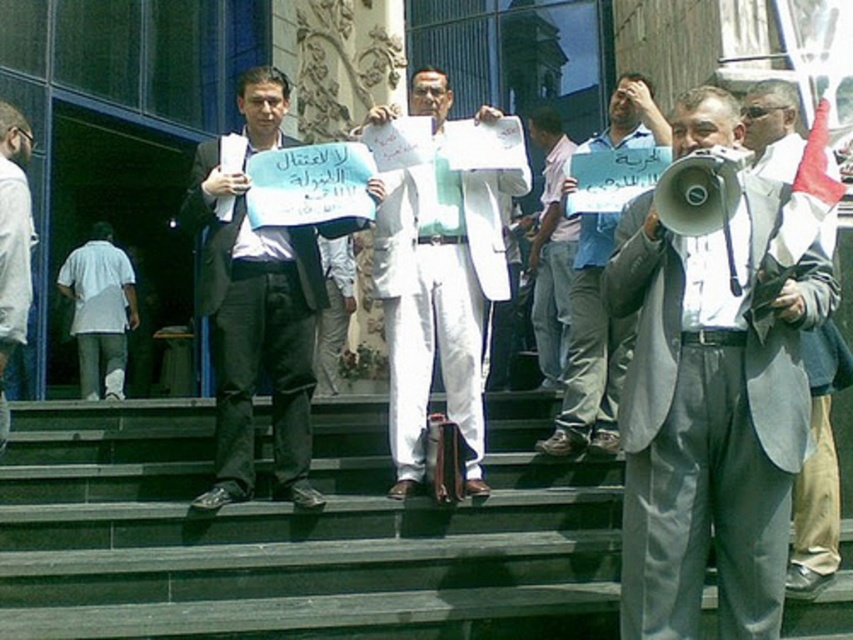
You are a photographer trying to capture a clear photo of the light gray suit coat at center and the white shirt at left. Since you want both subjects to appear the same size in the photo, which subject should you move closer to the camera?

The light gray suit coat at center has a larger width than the white shirt at left, so you should move the light gray suit coat at center closer to the camera to make them appear the same size in the photo.

You are a photographer trying to capture a clear shot of the gray suit at center and the white paper sign at center. Based on their relative heights, which object should you focus on first to ensure both are in frame without needing to adjust your camera angle?

The gray suit at center is shorter than the white paper sign at center. To capture both in frame, focus on the gray suit at center first since it is lower, then ensure the taller white paper sign at center is also in view.